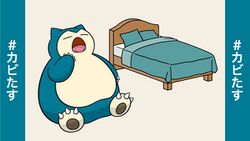
Where is `blue sheets`? Image resolution: width=250 pixels, height=141 pixels. blue sheets is located at coordinates (170, 71).